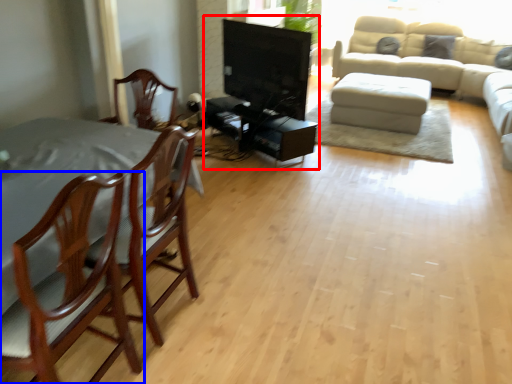
Question: Which object is closer to the camera taking this photo, entertainment center (highlighted by a red box) or chair (highlighted by a blue box)?

Choices:
 (A) entertainment center
 (B) chair

Answer: (B)